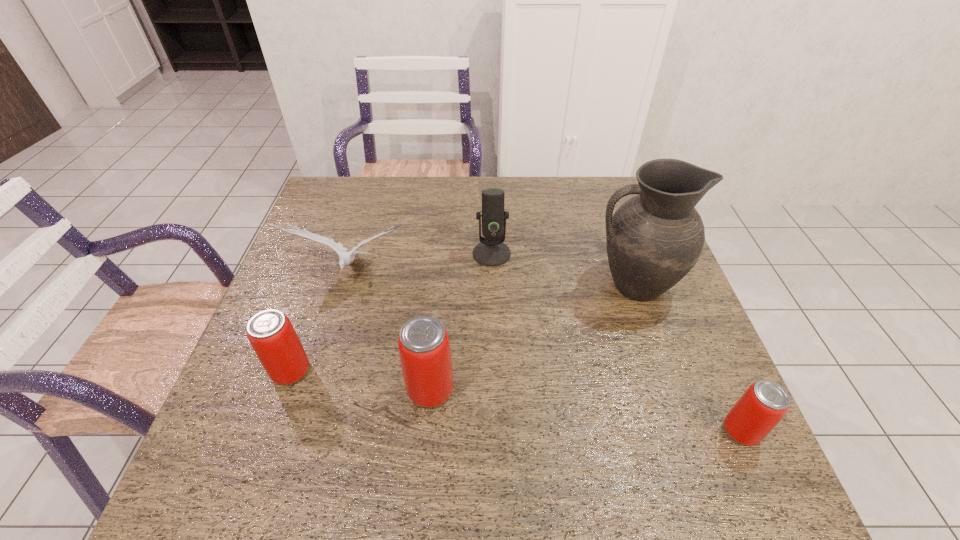
This screenshot has height=540, width=960. In order to click on free area in between the second tallest beer can and the shortest object in this screenshot , I will do `click(516, 401)`.

Locate an element on the screen. The width and height of the screenshot is (960, 540). empty space that is in between the tallest object and the second beer can from right to left is located at coordinates (532, 338).

Where is `vacant area between the second beer can from left to right and the gull`? The width and height of the screenshot is (960, 540). vacant area between the second beer can from left to right and the gull is located at coordinates (392, 331).

Locate an element on the screen. The height and width of the screenshot is (540, 960). free point between the gull and the tallest object is located at coordinates (492, 279).

Find the location of a particular element. vacant space in between the microphone and the rightmost beer can is located at coordinates (616, 342).

The width and height of the screenshot is (960, 540). I want to click on free space between the second tallest beer can and the pitcher, so click(x=462, y=328).

The image size is (960, 540). In order to click on vacant region between the second beer can from left to right and the gull in this screenshot , I will do (x=392, y=331).

Choose which object is the second nearest neighbor to the gull. Please provide its 2D coordinates. Your answer should be formatted as a tuple, i.e. [(x, y)], where the tuple contains the x and y coordinates of a point satisfying the conditions above.

[(270, 333)]

Select which object is the fifth closest to the pitcher. Please provide its 2D coordinates. Your answer should be formatted as a tuple, i.e. [(x, y)], where the tuple contains the x and y coordinates of a point satisfying the conditions above.

[(270, 333)]

Identify the location of beer can identified as the closest to the leftmost beer can. This screenshot has width=960, height=540. (424, 348).